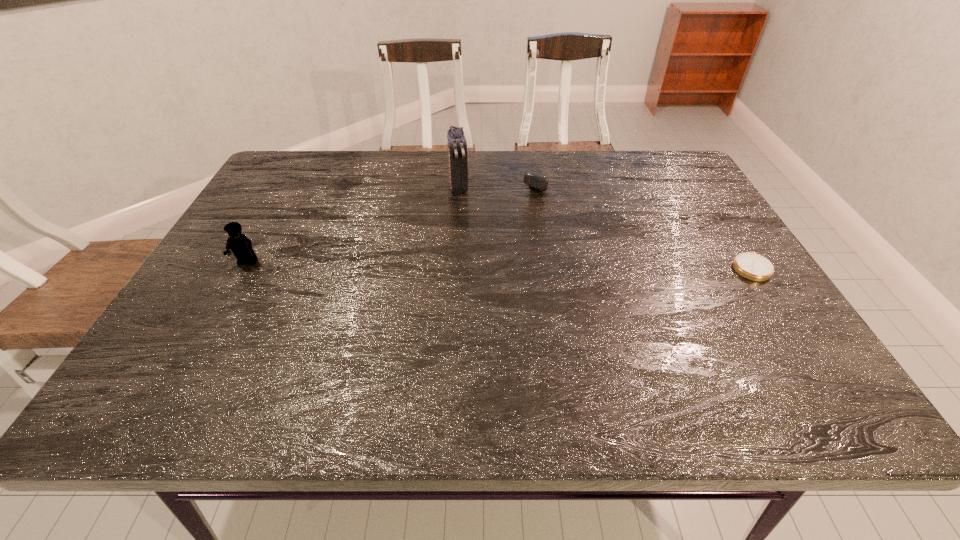
Where is `vacant space at the far edge of the desktop`? Image resolution: width=960 pixels, height=540 pixels. vacant space at the far edge of the desktop is located at coordinates (539, 174).

You are a GUI agent. You are given a task and a screenshot of the screen. Output one action in this format:
    pyautogui.click(x=<x>, y=<y>)
    Task: Click on the free point at the near edge
    Image resolution: width=960 pixels, height=540 pixels.
    Given the screenshot: What is the action you would take?
    coord(588,340)

Identify the location of vacant space at the right edge. (713, 292).

Find the location of a particular element. vacant area at the far left corner of the desktop is located at coordinates (286, 161).

Where is `vacant space at the near left corner of the desktop`? This screenshot has height=540, width=960. vacant space at the near left corner of the desktop is located at coordinates (184, 354).

Find the location of `vacant space at the far right corner`. vacant space at the far right corner is located at coordinates (652, 156).

Identify the location of free space between the second object from left to right and the second shortest object. [503, 181].

Image resolution: width=960 pixels, height=540 pixels. I want to click on free space between the shortest object and the leftmost object, so click(x=498, y=265).

Identify the location of vacant point located between the third object from right to left and the third tallest object. (503, 181).

You are a GUI agent. You are given a task and a screenshot of the screen. Output one action in this format:
    pyautogui.click(x=<x>, y=<y>)
    Task: Click on the vacant area that lies between the third shortest object and the compass
    This screenshot has height=540, width=960.
    Given the screenshot: What is the action you would take?
    pyautogui.click(x=498, y=265)